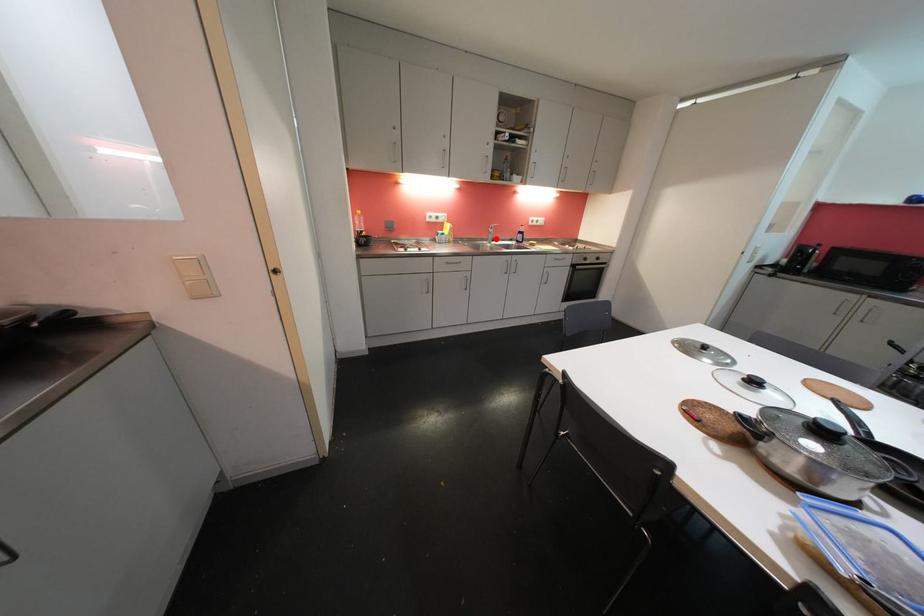
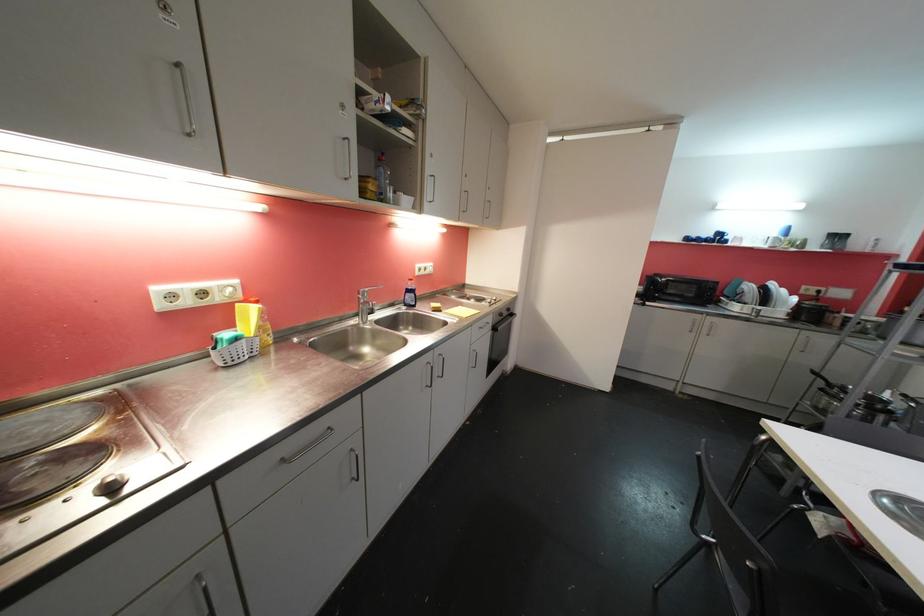
Find the pixel in the second image that matches the highlighted location in the first image.

(370, 310)